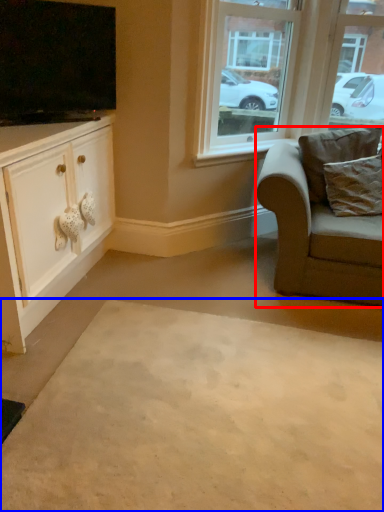
Question: Which of the following is the farthest to the observer, chair (highlighted by a red box) or plain (highlighted by a blue box)?

Choices:
 (A) chair
 (B) plain

Answer: (A)